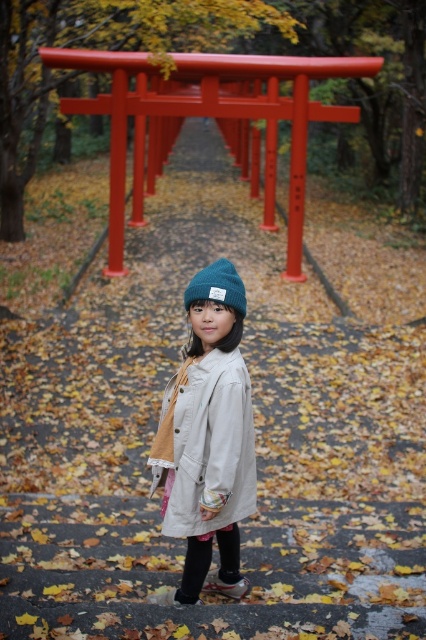
Consider the image. You are a fashion designer observing the autumn scene. You notice the matte beige coat at center and the knitted woolen beanie at center. Which clothing item is positioned to the left?

The matte beige coat at center is positioned on the left side of the knitted woolen beanie at center, so the matte beige coat at center is to the left.

You are a photographer trying to capture the child in the scene. Since the matte beige coat at center and the knitted woolen beanie at center are both visible, which one appears larger in the photo?

The matte beige coat at center appears larger in the photo because it is closer to the viewer than the knitted woolen beanie at center.